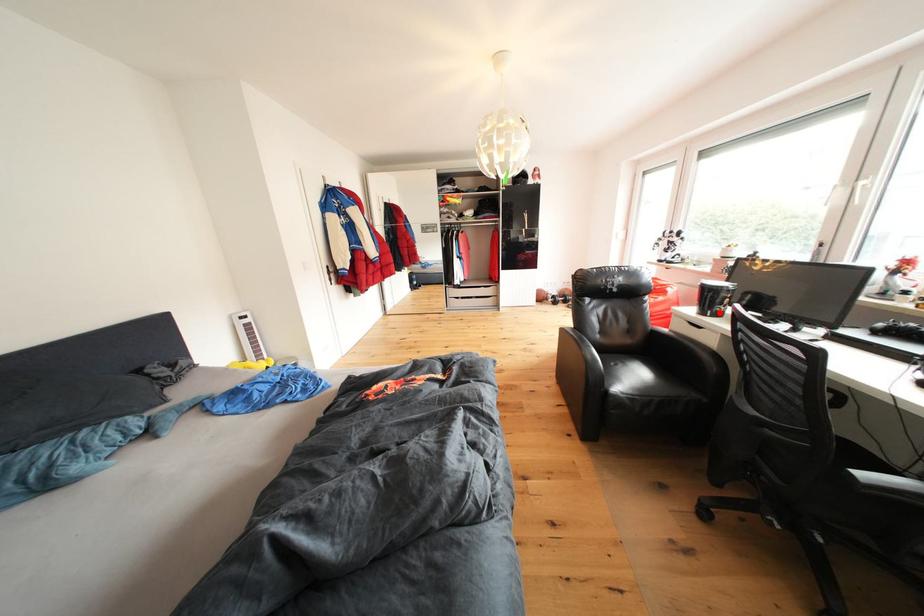
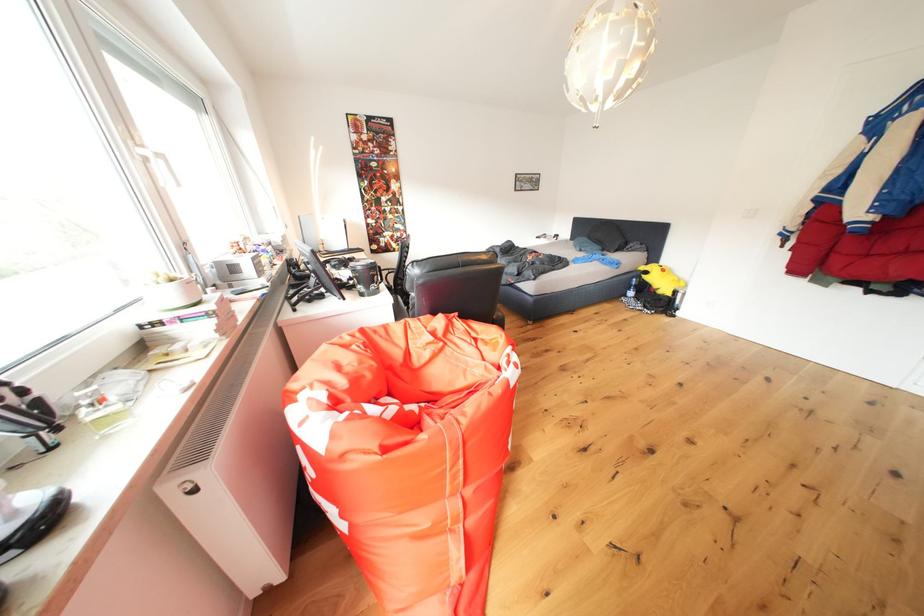
Question: I am providing you with two images of the same scene from different viewpoints. A red point is marked on the first image. Can you still see the location of the red point in image 2?

Choices:
 (A) Yes
 (B) No

Answer: (B)